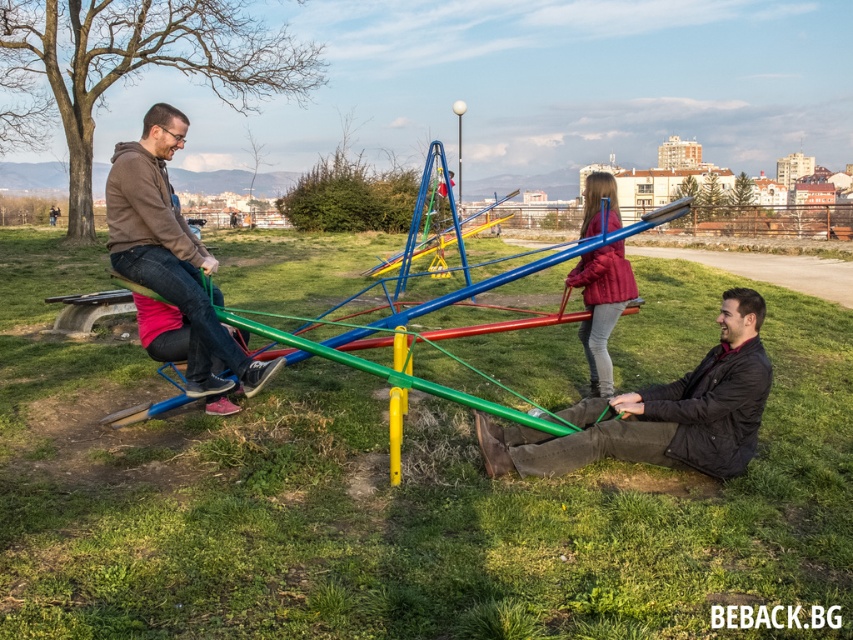
You are a parent supervising children at the park. You notice the green rubber band at center and the black leather jacket at lower right. Which object is positioned closer to the left side of the seesaw?

The green rubber band at center is positioned to the left of the black leather jacket at lower right, so it is closer to the left side of the seesaw.

You are a parent supervising children at the park. You notice the green rubber band at center and the black leather jacket at lower right. Which object is closer to you, the observer?

The green rubber band at center is closer to you because it is in front of the black leather jacket at lower right.

You are a parent at the park watching your children play on the seesaw. You notice a green rubber band at center and a black leather jacket at lower right. Which object is bigger?

The green rubber band at center is larger in size than the black leather jacket at lower right.